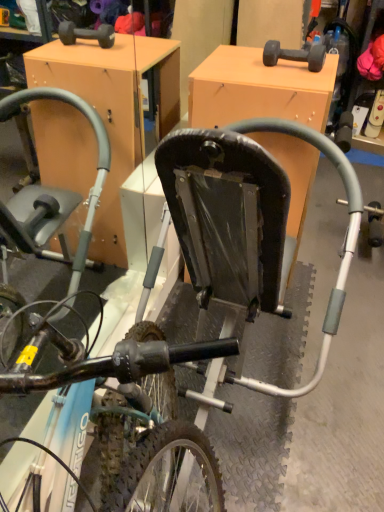
Find the location of a particular element. The image size is (384, 512). vacant point above matte orange cabinet at center (from a real-world perspective) is located at coordinates [x=256, y=68].